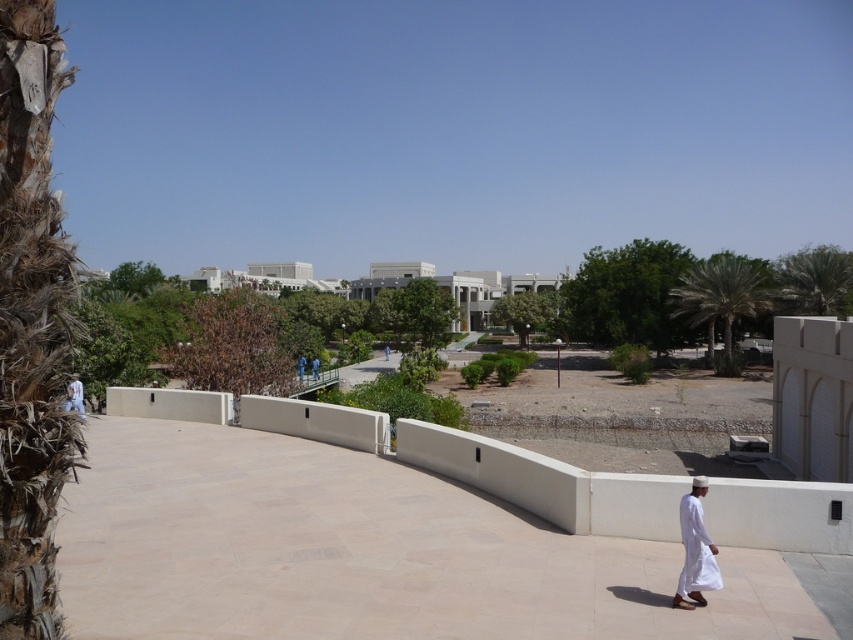
Can you confirm if green leafy palm tree at upper right is positioned to the left of blue fabric robe at center?

No, green leafy palm tree at upper right is not to the left of blue fabric robe at center.

Between green leafy palm tree at upper right and blue fabric robe at center, which one has less height?

blue fabric robe at center is shorter.

Between point (839, 253) and point (297, 358), which one is positioned in front?

Point (297, 358) is more forward.

Locate an element on the screen. green leafy palm tree at upper right is located at coordinates (814, 280).

Is white smooth ledge at center closer to the viewer compared to white cotton robe at lower left?

Yes, white smooth ledge at center is in front of white cotton robe at lower left.

Which is more to the right, white smooth ledge at center or white cotton robe at lower left?

white smooth ledge at center

Measure the distance between white smooth ledge at center and camera.

white smooth ledge at center and camera are 9.00 meters apart from each other.

This screenshot has width=853, height=640. I want to click on white smooth ledge at center, so click(x=547, y=483).

Which is in front, point (540, 456) or point (682, 576)?

Point (682, 576) is in front.

In the scene shown: Who is more distant from viewer, (288, 416) or (706, 570)?

The point (288, 416) is more distant.

The image size is (853, 640). What do you see at coordinates (547, 483) in the screenshot?
I see `white smooth ledge at center` at bounding box center [547, 483].

You are a GUI agent. You are given a task and a screenshot of the screen. Output one action in this format:
    pyautogui.click(x=<x>, y=<y>)
    Task: Click on the white smooth ledge at center
    Image resolution: width=853 pixels, height=640 pixels.
    Given the screenshot: What is the action you would take?
    pyautogui.click(x=547, y=483)